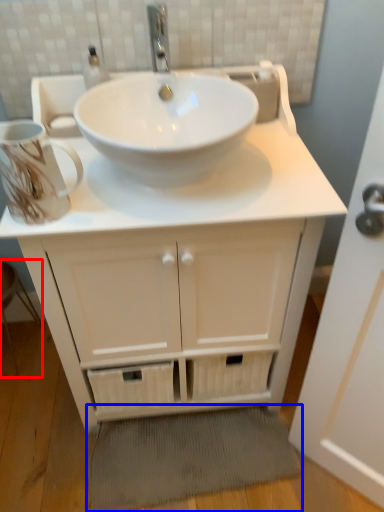
Question: Which of the following is the farthest to the observer, step stool (highlighted by a red box) or bath mat (highlighted by a blue box)?

Choices:
 (A) step stool
 (B) bath mat

Answer: (A)